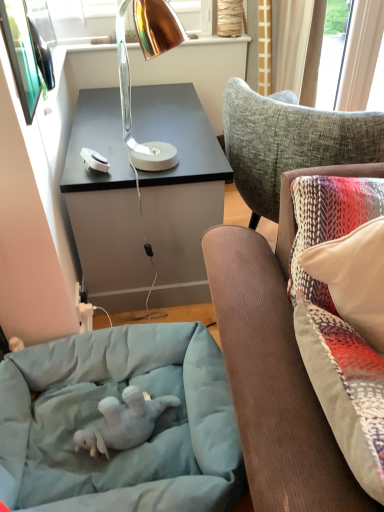
Question: Does soft gray plush baby elephant at lower left have a smaller size compared to light blue fabric dog bed at lower left?

Choices:
 (A) no
 (B) yes

Answer: (B)

Question: From the image's perspective, is soft gray plush baby elephant at lower left located above light blue fabric dog bed at lower left?

Choices:
 (A) yes
 (B) no

Answer: (B)

Question: Is soft gray plush baby elephant at lower left to the right of light blue fabric dog bed at lower left from the viewer's perspective?

Choices:
 (A) yes
 (B) no

Answer: (A)

Question: Are soft gray plush baby elephant at lower left and light blue fabric dog bed at lower left making contact?

Choices:
 (A) no
 (B) yes

Answer: (A)

Question: Can you confirm if soft gray plush baby elephant at lower left is positioned to the left of light blue fabric dog bed at lower left?

Choices:
 (A) no
 (B) yes

Answer: (A)

Question: Considering the relative sizes of soft gray plush baby elephant at lower left and light blue fabric dog bed at lower left in the image provided, is soft gray plush baby elephant at lower left thinner than light blue fabric dog bed at lower left?

Choices:
 (A) no
 (B) yes

Answer: (B)

Question: Considering the relative sizes of copper metallic desk lamp at upper center and light blue fabric dog bed at lower left in the image provided, is copper metallic desk lamp at upper center taller than light blue fabric dog bed at lower left?

Choices:
 (A) yes
 (B) no

Answer: (A)

Question: Considering the relative positions of copper metallic desk lamp at upper center and light blue fabric dog bed at lower left in the image provided, is copper metallic desk lamp at upper center to the right of light blue fabric dog bed at lower left from the viewer's perspective?

Choices:
 (A) yes
 (B) no

Answer: (A)

Question: Is copper metallic desk lamp at upper center closer to camera compared to light blue fabric dog bed at lower left?

Choices:
 (A) yes
 (B) no

Answer: (B)

Question: Does copper metallic desk lamp at upper center turn towards light blue fabric dog bed at lower left?

Choices:
 (A) no
 (B) yes

Answer: (A)

Question: Is light blue fabric dog bed at lower left surrounded by copper metallic desk lamp at upper center?

Choices:
 (A) yes
 (B) no

Answer: (B)

Question: Is copper metallic desk lamp at upper center facing away from light blue fabric dog bed at lower left?

Choices:
 (A) no
 (B) yes

Answer: (A)

Question: From the image's perspective, is copper metallic desk lamp at upper center on top of soft gray plush baby elephant at lower left?

Choices:
 (A) yes
 (B) no

Answer: (A)